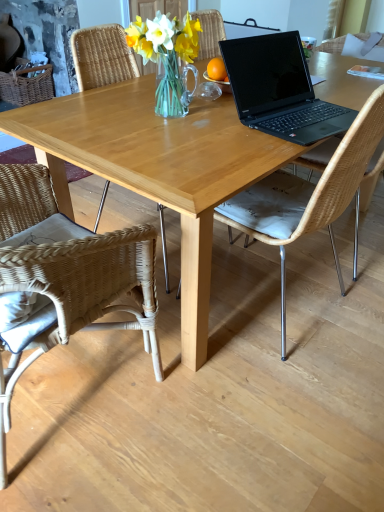
Locate an element on the screen. The width and height of the screenshot is (384, 512). vacant space to the right of woven rattan chair at lower left, positioned as the second chair in right-to-left order is located at coordinates (221, 436).